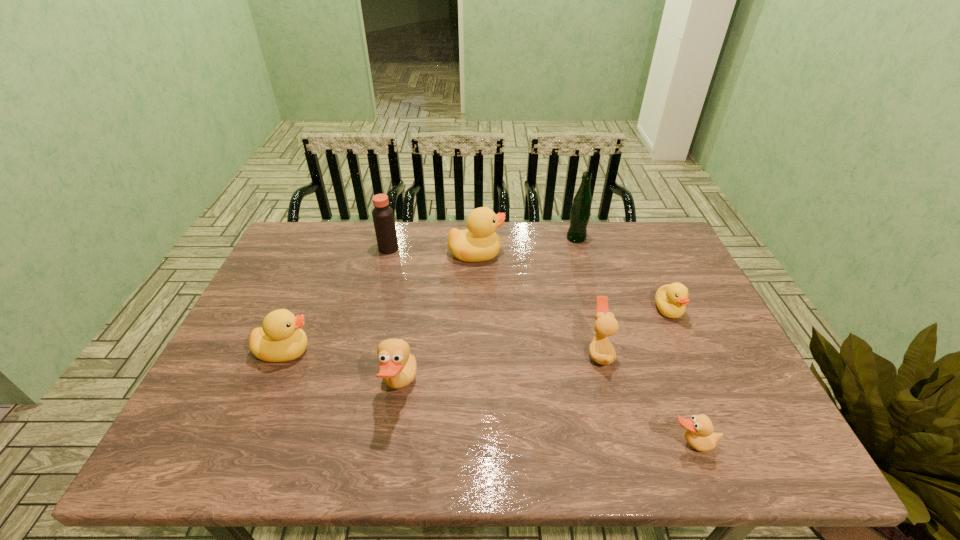
The height and width of the screenshot is (540, 960). I want to click on free space that is in between the leftmost tan duck and the second farthest duck, so click(x=534, y=348).

Identify the location of free space between the third object from left to right and the nearest duck. (545, 416).

You are a GUI agent. You are given a task and a screenshot of the screen. Output one action in this format:
    pyautogui.click(x=<x>, y=<y>)
    Task: Click on the free space between the fourth farthest object and the second biggest tan duck
    Image resolution: width=960 pixels, height=540 pixels.
    Given the screenshot: What is the action you would take?
    pyautogui.click(x=634, y=330)

This screenshot has width=960, height=540. Identify the location of vacant area that lies between the second duck from left to right and the second object from left to right. (395, 318).

At what (x,y) coordinates should I click in order to perform the action: click on free space that is in between the second farthest yellow duck and the green beer bottle. Please return your answer as a coordinate pair (x, y). The image size is (960, 540). Looking at the image, I should click on (622, 274).

Find the location of a particular element. vacant space that's between the second smallest yellow duck and the tallest object is located at coordinates (430, 294).

Where is `empty space between the leftmost object and the second tan duck from left to right`? Image resolution: width=960 pixels, height=540 pixels. empty space between the leftmost object and the second tan duck from left to right is located at coordinates click(442, 352).

Identify which object is located as the second nearest to the vinegar. Please provide its 2D coordinates. Your answer should be formatted as a tuple, i.e. [(x, y)], where the tuple contains the x and y coordinates of a point satisfying the conditions above.

[(280, 339)]

Image resolution: width=960 pixels, height=540 pixels. I want to click on the sixth closest object to the rightmost tan duck, so click(280, 339).

This screenshot has width=960, height=540. I want to click on the second closest duck to the third duck from right to left, so click(x=699, y=433).